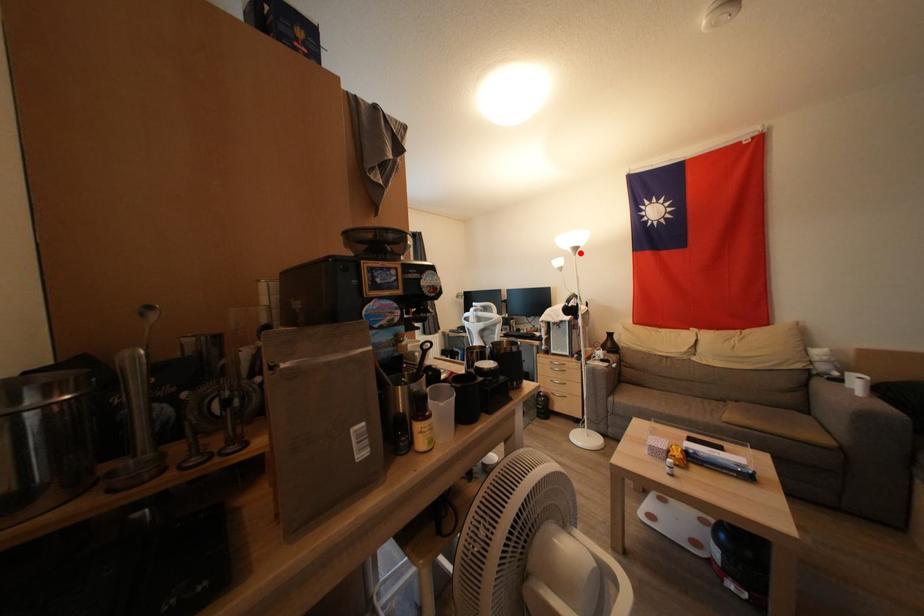
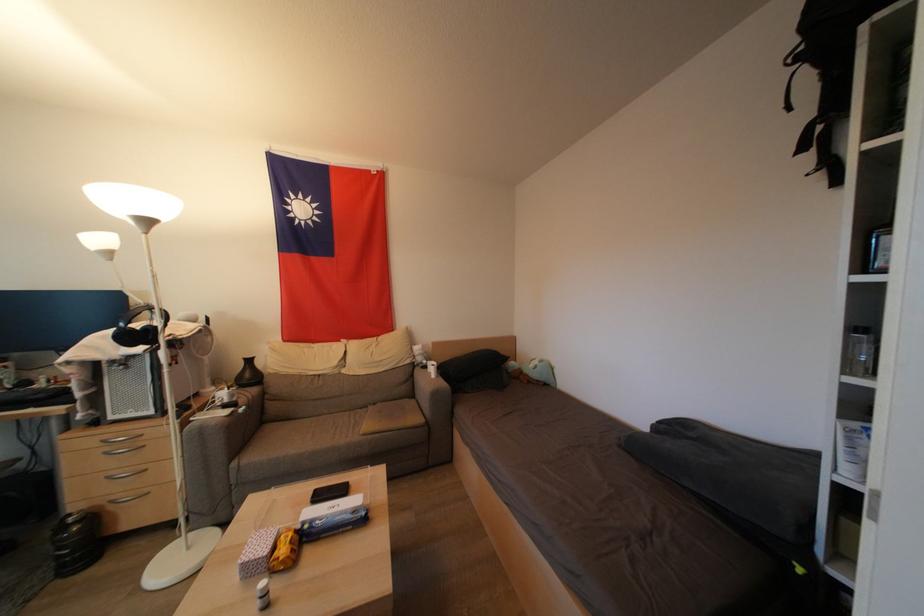
Find the pixel in the second image that matches the highlighted location in the first image.

(152, 225)